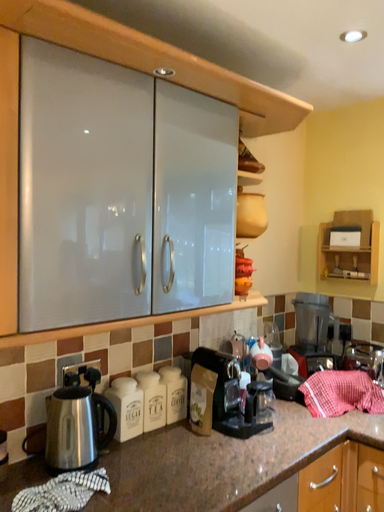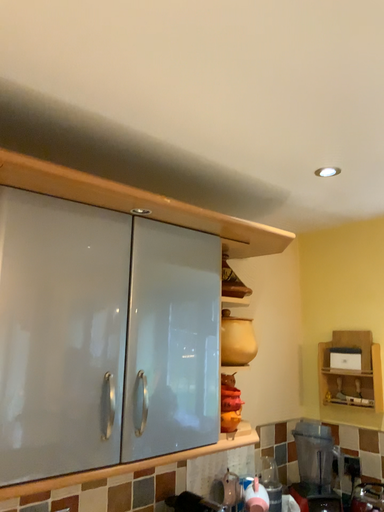
Question: How did the camera likely rotate when shooting the video?

Choices:
 (A) rotated downward
 (B) rotated upward

Answer: (B)